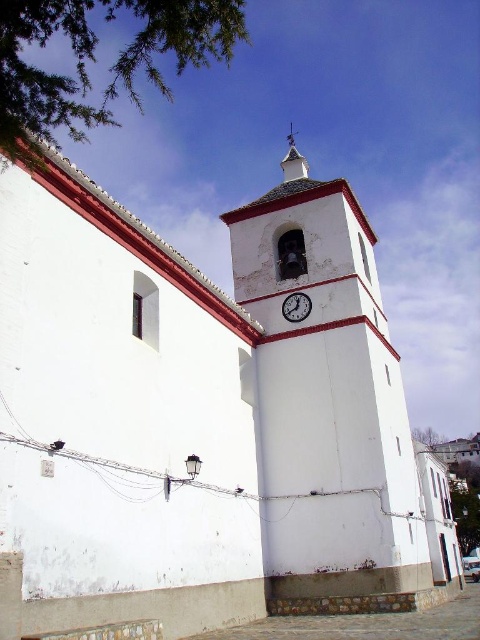
Question: Is white painted brick clock tower at center to the right of white wood spire at upper center from the viewer's perspective?

Choices:
 (A) yes
 (B) no

Answer: (B)

Question: Among these objects, which one is nearest to the camera?

Choices:
 (A) white wood spire at upper center
 (B) white glossy clock at upper center
 (C) white painted brick clock tower at center

Answer: (C)

Question: Does white painted brick clock tower at center come behind white glossy clock at upper center?

Choices:
 (A) yes
 (B) no

Answer: (B)

Question: Which of these objects is positioned closest to the white glossy clock at upper center?

Choices:
 (A) white wood spire at upper center
 (B) white painted brick clock tower at center

Answer: (B)

Question: Among these objects, which one is nearest to the camera?

Choices:
 (A) white wood spire at upper center
 (B) white glossy clock at upper center
 (C) white painted brick clock tower at center

Answer: (C)

Question: Is white painted brick clock tower at center to the left of white wood spire at upper center from the viewer's perspective?

Choices:
 (A) no
 (B) yes

Answer: (B)